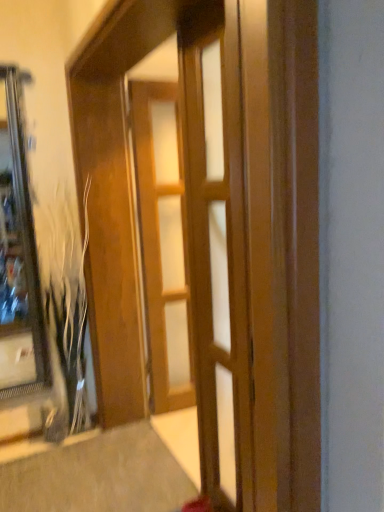
Question: Does point (196, 140) appear closer or farther from the camera than point (243, 364)?

Choices:
 (A) farther
 (B) closer

Answer: (A)

Question: Is wooden barn door at center situated inside wooden door at center, which appears as the 1th door when viewed from the front, or outside?

Choices:
 (A) inside
 (B) outside

Answer: (B)

Question: Based on their relative distances, which object is nearer to the wooden barn door at center?

Choices:
 (A) wooden door at center, which appears as the 2th door when viewed from the back
 (B) wooden door at center, which is the 2th door from front to back

Answer: (A)

Question: Which object is positioned farthest from the wooden barn door at center?

Choices:
 (A) wooden door at center, which is the 2th door from front to back
 (B) wooden door at center, which appears as the 2th door when viewed from the back

Answer: (A)